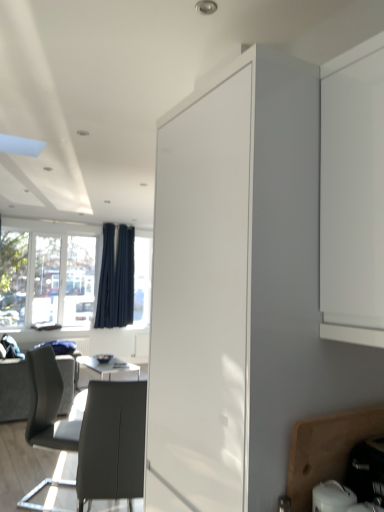
Question: From a real-world perspective, is wooden cutting board at lower right, which is the first cabinetry from bottom to top, above or below dark blue fabric curtain at left, arranged as the first curtain when viewed from the left?

Choices:
 (A) below
 (B) above

Answer: (A)

Question: In terms of size, does wooden cutting board at lower right, placed as the second cabinetry when sorted from top to bottom, appear bigger or smaller than dark blue fabric curtain at left, arranged as the first curtain when viewed from the left?

Choices:
 (A) small
 (B) big

Answer: (A)

Question: Which of these objects is positioned farthest from the dark gray fabric couch at lower left?

Choices:
 (A) matte gray chair at lower left, positioned as the first chair in back-to-front order
 (B) white glossy cabinet at center, which appears as the 1th cabinetry when viewed from the top
 (C) matte gray chair at lower left, placed as the second chair when sorted from back to front
 (D) wooden cutting board at lower right, which is the first cabinetry from bottom to top
 (E) transparent glass window at left

Answer: (D)

Question: Considering the real-world distances, which object is farthest from the white glossy cabinet at center, which is counted as the second cabinetry, starting from the bottom?

Choices:
 (A) dark gray fabric couch at lower left
 (B) transparent glass window at left
 (C) matte gray chair at lower left, placed as the second chair when sorted from front to back
 (D) dark blue fabric curtain at left, which is the second curtain in right-to-left order
 (E) wooden cutting board at lower right, which is the first cabinetry from bottom to top

Answer: (D)